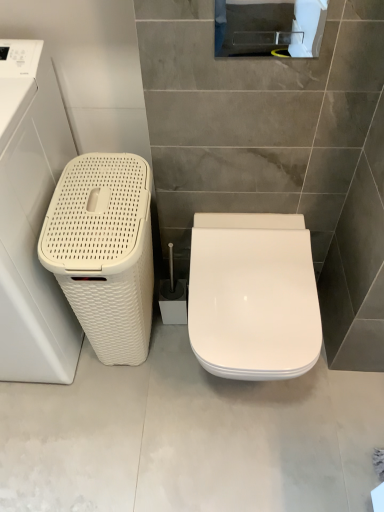
Question: Is white woven basket at left in front of or behind white glossy toilet seat at center in the image?

Choices:
 (A) front
 (B) behind

Answer: (A)

Question: From a real-world perspective, is white woven basket at left physically located above or below white glossy toilet seat at center?

Choices:
 (A) above
 (B) below

Answer: (A)

Question: Estimate the real-world distances between objects in this image. Which object is farther from the white woven basket at left?

Choices:
 (A) white glossy toilet at center
 (B) white woven basket at left
 (C) white glossy toilet seat at center

Answer: (A)

Question: Which object is positioned farthest from the white woven basket at left?

Choices:
 (A) white glossy toilet seat at center
 (B) white woven basket at left
 (C) white glossy toilet at center

Answer: (A)